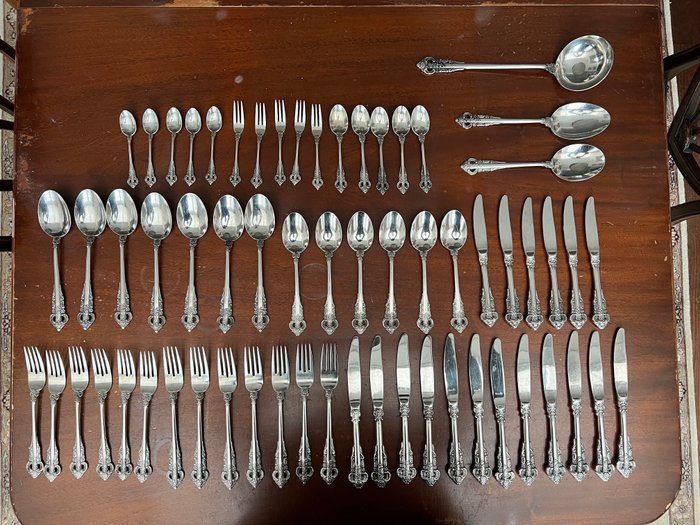
Image resolution: width=700 pixels, height=525 pixels. I want to click on small forks, so click(238, 120), click(259, 127), click(280, 122), click(299, 122), click(315, 124).